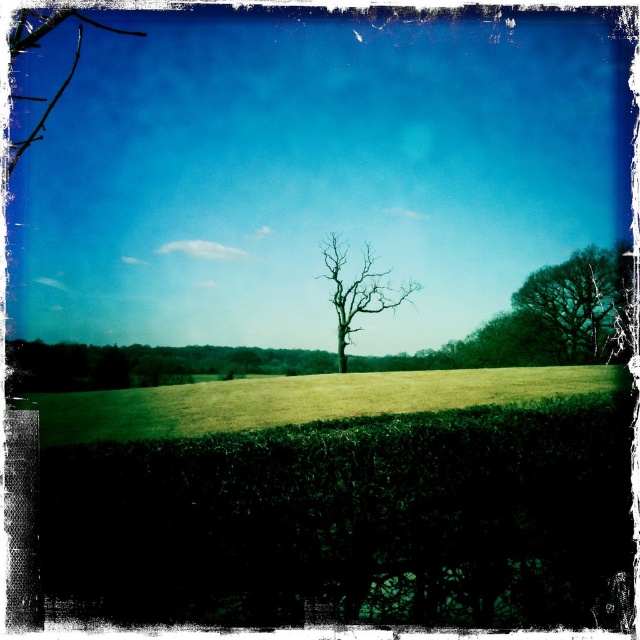
Can you confirm if green leafy tree at upper right is shorter than bare wood tree at center?

No, green leafy tree at upper right is not shorter than bare wood tree at center.

What are the coordinates of `green leafy tree at upper right` in the screenshot? It's located at (582, 304).

This screenshot has width=640, height=640. What do you see at coordinates (349, 520) in the screenshot? I see `green leafy hedge at lower center` at bounding box center [349, 520].

Between green leafy hedge at lower center and green grassy field at center, which one is positioned higher?

green leafy hedge at lower center is higher up.

Describe the element at coordinates (349, 520) in the screenshot. I see `green leafy hedge at lower center` at that location.

You are a GUI agent. You are given a task and a screenshot of the screen. Output one action in this format:
    pyautogui.click(x=<x>, y=<y>)
    Task: Click on the green leafy hedge at lower center
    The width and height of the screenshot is (640, 640).
    Given the screenshot: What is the action you would take?
    (x=349, y=520)

Between green leafy hedge at lower center and green leafy tree at upper right, which one has less height?

green leafy hedge at lower center is shorter.

Does point (163, 458) come behind point (554, 266)?

No, it is not.

Where is `green leafy hedge at lower center`? green leafy hedge at lower center is located at coordinates (349, 520).